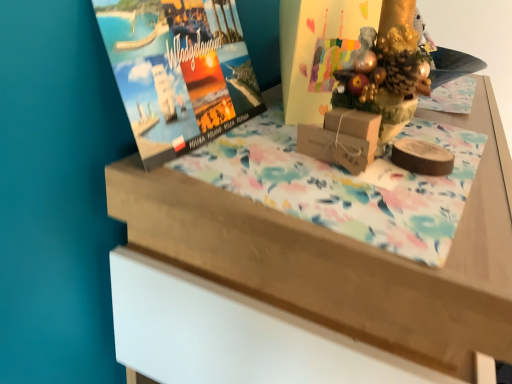
In order to click on vacant space in front of matte cardboard book cover at center in this screenshot , I will do `click(289, 158)`.